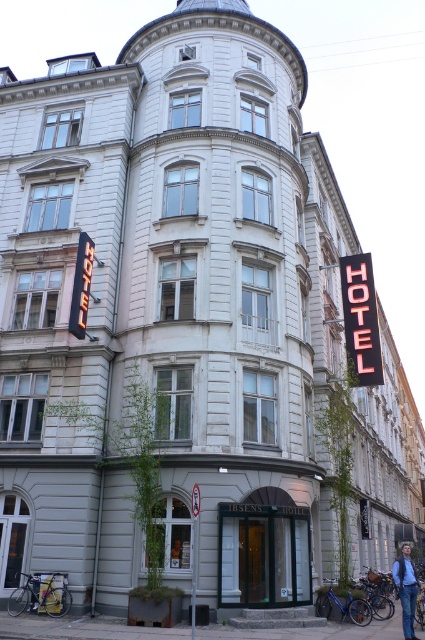
Question: Is neon/black hotel sign at upper right further to the viewer compared to blue denim jeans at lower right?

Choices:
 (A) no
 (B) yes

Answer: (B)

Question: Is neon/black hotel sign at upper right smaller than blue denim jeans at lower right?

Choices:
 (A) no
 (B) yes

Answer: (B)

Question: Which point is farther to the camera?

Choices:
 (A) blue denim jeans at lower right
 (B) neon/black hotel sign at upper right

Answer: (B)

Question: Does neon/black hotel sign at upper right have a lesser width compared to blue denim jeans at lower right?

Choices:
 (A) yes
 (B) no

Answer: (A)